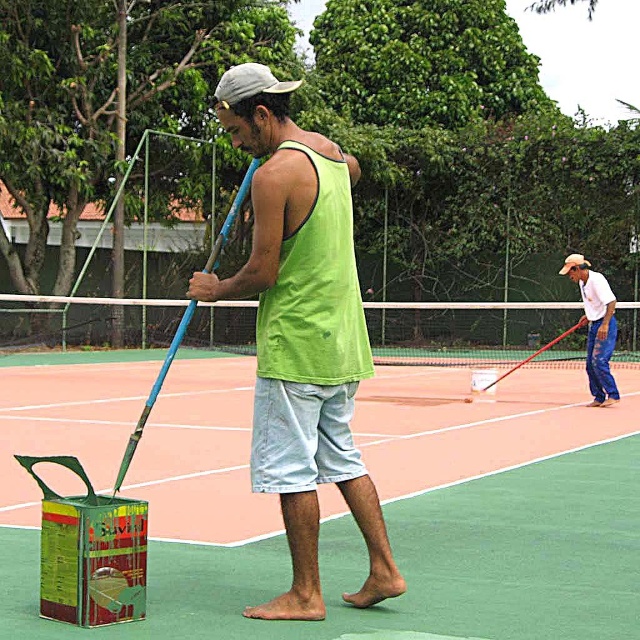
You are a maintenance worker on the tennis court. You need to place a ladder between the green rubber tennis court at center and the light blue jeans at right. Which object should the ladder be placed closer to in order to ensure stability?

The ladder should be placed closer to the green rubber tennis court at center because it has a greater height compared to the light blue jeans at right, providing a more stable base.

You are standing at the entrance of the tennis court and need to reach the green rubber tennis court at center. According to the coordinates provided, in which direction should you move from your current position?

The green rubber tennis court at center is located at point 0.783 on the x and 0.534 on the y axis. Since you are at the entrance, which is typically at the edge, you should move towards the center of the court to reach it.